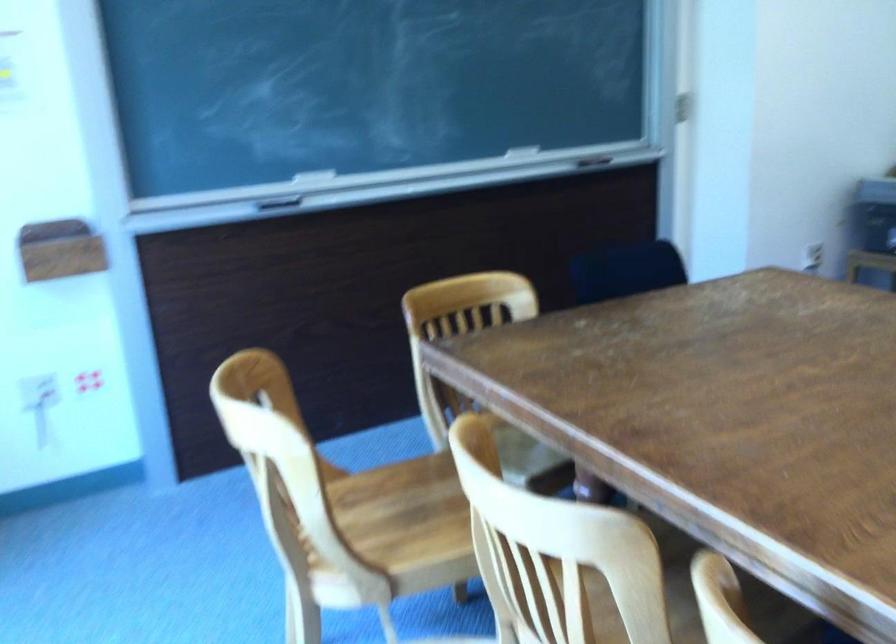
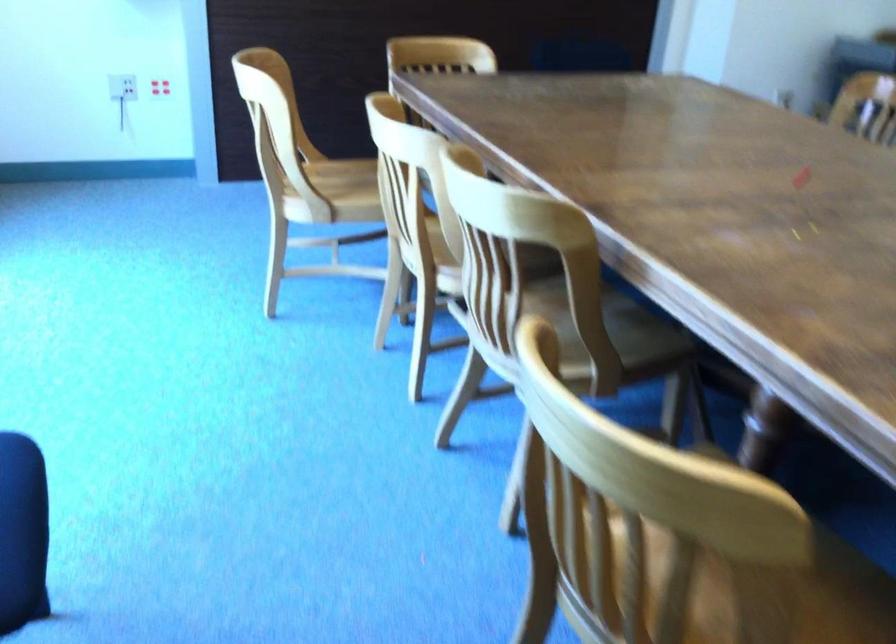
Question: The first image is from the beginning of the video and the second image is from the end. How did the camera likely rotate when shooting the video?

Choices:
 (A) Left
 (B) Right
 (C) Up
 (D) Down

Answer: (D)